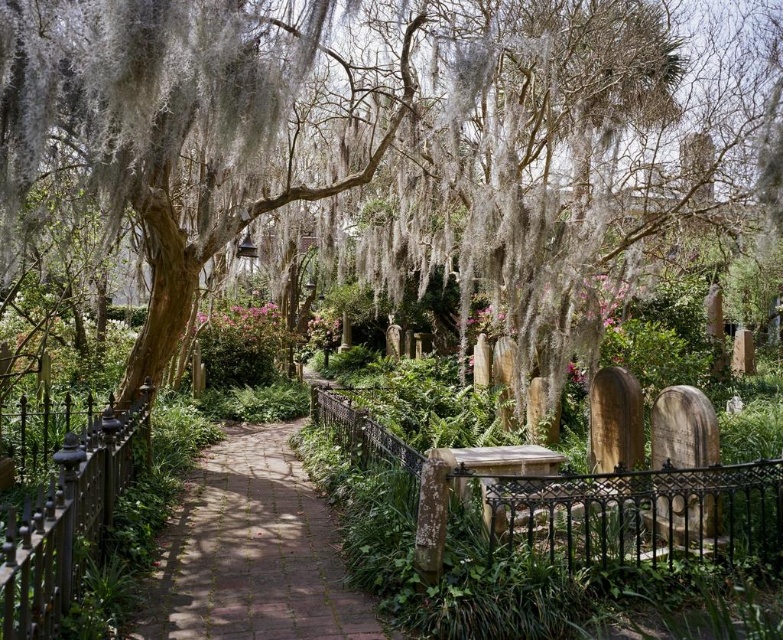
Is black wrought iron fence at center taller than black wrought iron fence at left?

No, black wrought iron fence at center is not taller than black wrought iron fence at left.

Consider the image. Who is shorter, black wrought iron fence at center or black wrought iron fence at left?

With less height is black wrought iron fence at center.

Locate an element on the screen. Image resolution: width=783 pixels, height=640 pixels. black wrought iron fence at center is located at coordinates (632, 513).

Is brick paved path at center bigger than black wrought iron fence at center?

No.

Can you confirm if brick paved path at center is positioned to the left of black wrought iron fence at center?

Indeed, brick paved path at center is positioned on the left side of black wrought iron fence at center.

At what (x,y) coordinates should I click in order to perform the action: click on brick paved path at center. Please return your answer as a coordinate pair (x, y). Image resolution: width=783 pixels, height=640 pixels. Looking at the image, I should click on pos(251,552).

Does point (648, 160) come in front of point (727, 492)?

No, it is behind (727, 492).

Who is taller, green mossy tree at center or black wrought iron fence at center?

Standing taller between the two is green mossy tree at center.

What do you see at coordinates (390, 134) in the screenshot? This screenshot has width=783, height=640. I see `green mossy tree at center` at bounding box center [390, 134].

Identify the location of green mossy tree at center. (390, 134).